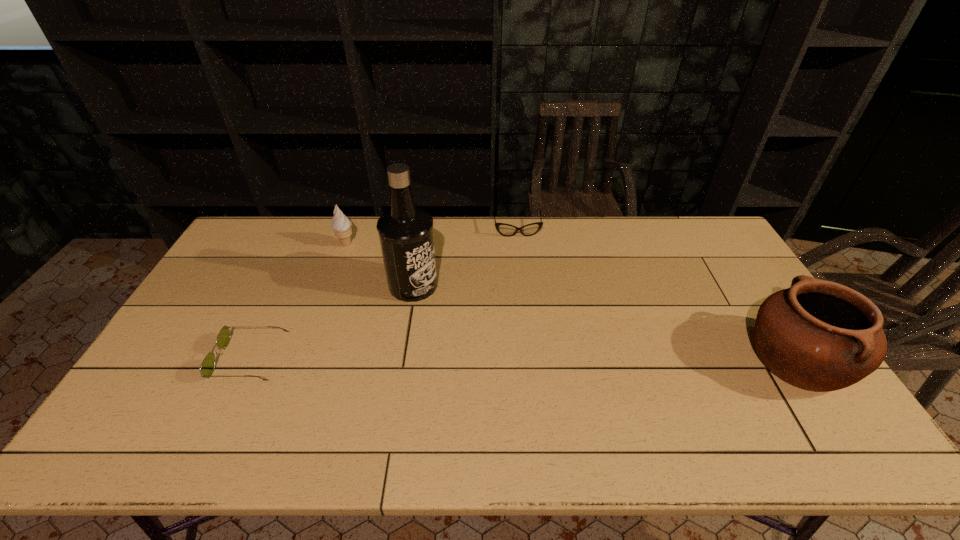
Where is `vacant region located on the front-facing side of the sunglasses`? Image resolution: width=960 pixels, height=540 pixels. vacant region located on the front-facing side of the sunglasses is located at coordinates (176, 359).

Find the location of a particular element. Image resolution: width=960 pixels, height=540 pixels. vacant space positioned 0.140m on the front-facing side of the sunglasses is located at coordinates [169, 359].

I want to click on free spot located 0.100m on the left of the pottery, so click(709, 360).

Locate an element on the screen. The height and width of the screenshot is (540, 960). vacant space located 0.180m on the front label of the third object from right to left is located at coordinates (484, 315).

This screenshot has width=960, height=540. Identify the location of vacant position located on the front label of the third object from right to left. (447, 300).

The image size is (960, 540). Identify the location of vacant area situated 0.290m on the front label of the third object from right to left. (516, 329).

This screenshot has width=960, height=540. I want to click on free space located on the front-facing side of the icecream, so click(x=380, y=282).

Find the location of `free point located 0.190m on the front-facing side of the icecream`. free point located 0.190m on the front-facing side of the icecream is located at coordinates (375, 278).

At what (x,y) coordinates should I click in order to perform the action: click on free spot located on the front-facing side of the icecream. Please return your answer as a coordinate pair (x, y). This screenshot has width=960, height=540. Looking at the image, I should click on pos(378,281).

Where is `free spot located on the front-facing side of the second object from right to left`? free spot located on the front-facing side of the second object from right to left is located at coordinates (531, 320).